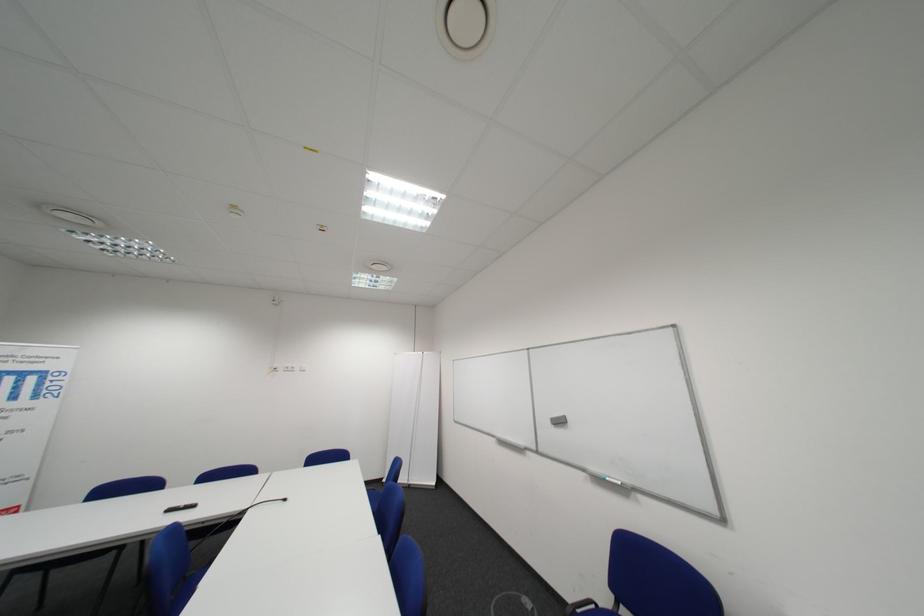
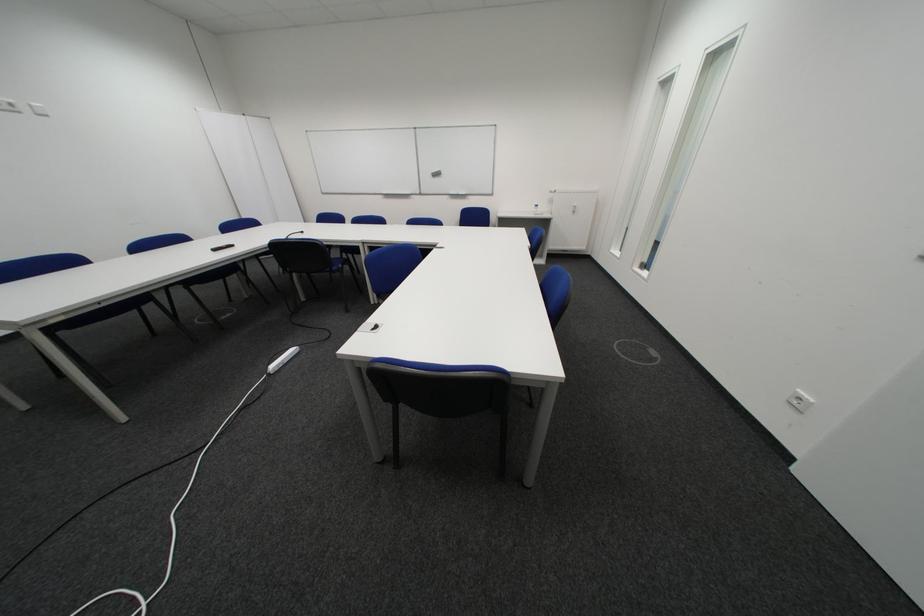
Find the pixel in the second image that matches (298,371) in the first image.

(8, 108)